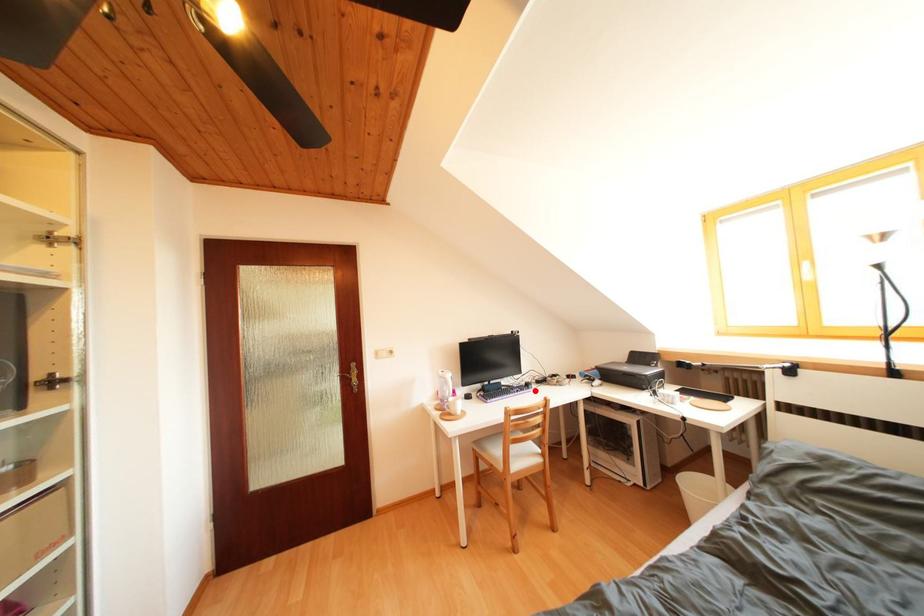
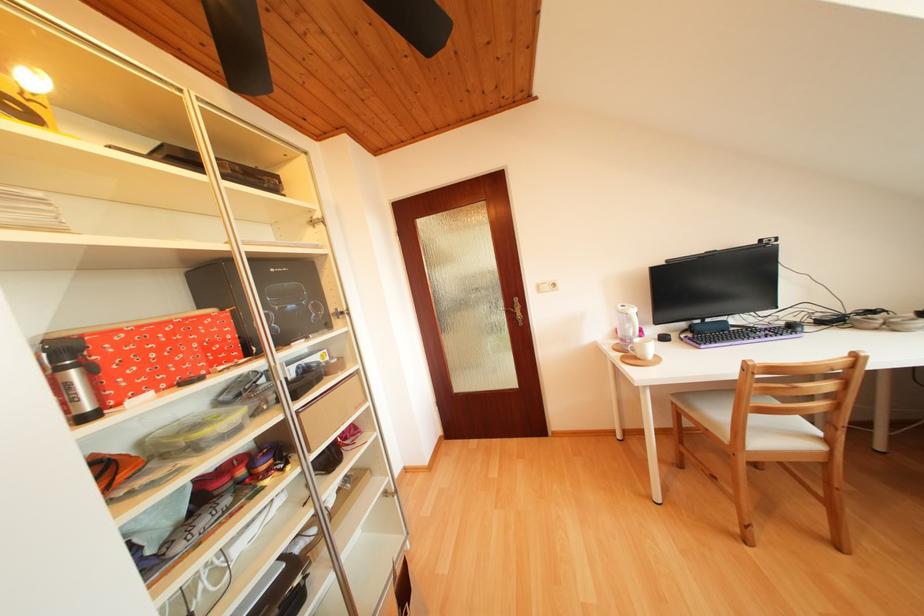
Where in the second image is the point corresponding to the highlighted location from the first image?

(799, 331)